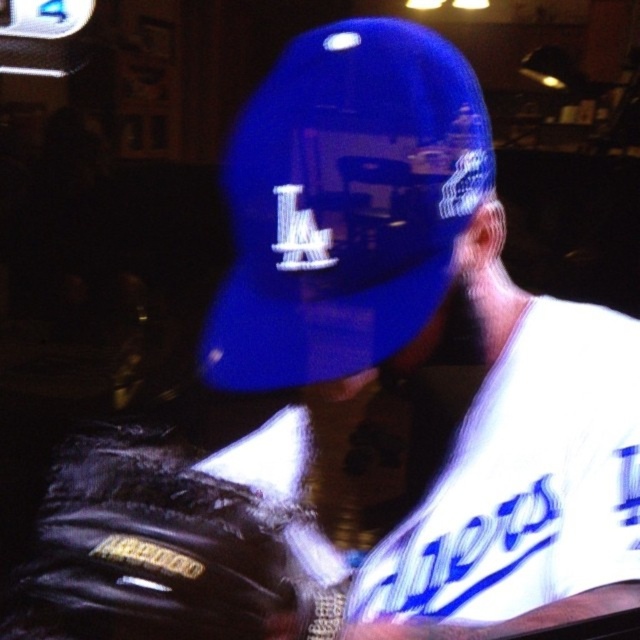
You are a photographer trying to capture a close shot of the player. Since you have a limited frame, you need to know which object is wider to prioritize framing. Which is wider, the glossy blue baseball cap at center or the black leather baseball glove at lower left?

The glossy blue baseball cap at center is wider than the black leather baseball glove at lower left according to the description.

Based on the scene description, where is the glossy blue baseball cap located in relation to the point at coordinates (344, 204)?

The glossy blue baseball cap at center is represented by the point at coordinates (344, 204).